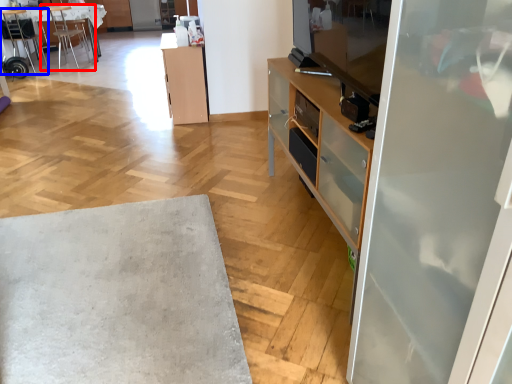
Question: Among these objects, which one is nearest to the camera, chair (highlighted by a red box) or chair (highlighted by a blue box)?

Choices:
 (A) chair
 (B) chair

Answer: (B)